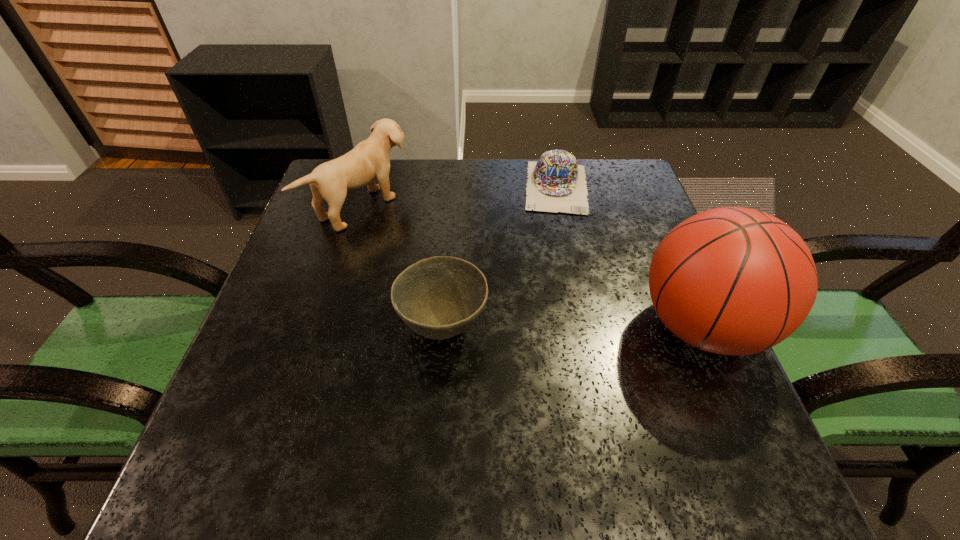
At what (x,y) coordinates should I click in order to perform the action: click on free space between the leftmost object and the third tallest object. Please return your answer as a coordinate pair (x, y). Looking at the image, I should click on (404, 266).

Identify the location of free space between the bowl and the basketball. The width and height of the screenshot is (960, 540). (572, 327).

Locate an element on the screen. Image resolution: width=960 pixels, height=540 pixels. vacant space that is in between the third object from left to right and the leftmost object is located at coordinates (461, 197).

At what (x,y) coordinates should I click in order to perform the action: click on unoccupied position between the basketball and the cap. Please return your answer as a coordinate pair (x, y). Image resolution: width=960 pixels, height=540 pixels. Looking at the image, I should click on (629, 257).

At what (x,y) coordinates should I click in order to perform the action: click on vacant region between the third object from right to left and the basketball. Please return your answer as a coordinate pair (x, y). The height and width of the screenshot is (540, 960). Looking at the image, I should click on (572, 327).

You are a GUI agent. You are given a task and a screenshot of the screen. Output one action in this format:
    pyautogui.click(x=<x>, y=<y>)
    Task: Click on the vacant point located between the puppy and the second shortest object
    The width and height of the screenshot is (960, 540).
    Given the screenshot: What is the action you would take?
    pyautogui.click(x=404, y=266)

The width and height of the screenshot is (960, 540). I want to click on free space between the tallest object and the puppy, so click(533, 266).

I want to click on free space between the second shortest object and the rightmost object, so click(x=572, y=327).

Locate an element on the screen. This screenshot has height=540, width=960. vacant region between the third tallest object and the puppy is located at coordinates (x=404, y=266).

I want to click on object that stands as the third closest to the shortest object, so click(369, 159).